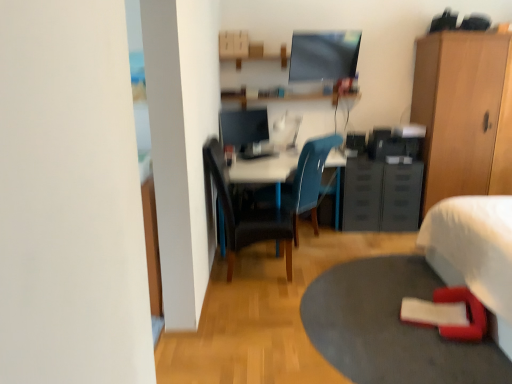
The height and width of the screenshot is (384, 512). I want to click on vacant area that lies in front of black leather chair at center, which appears as the 2th chair when viewed from the back, so click(252, 306).